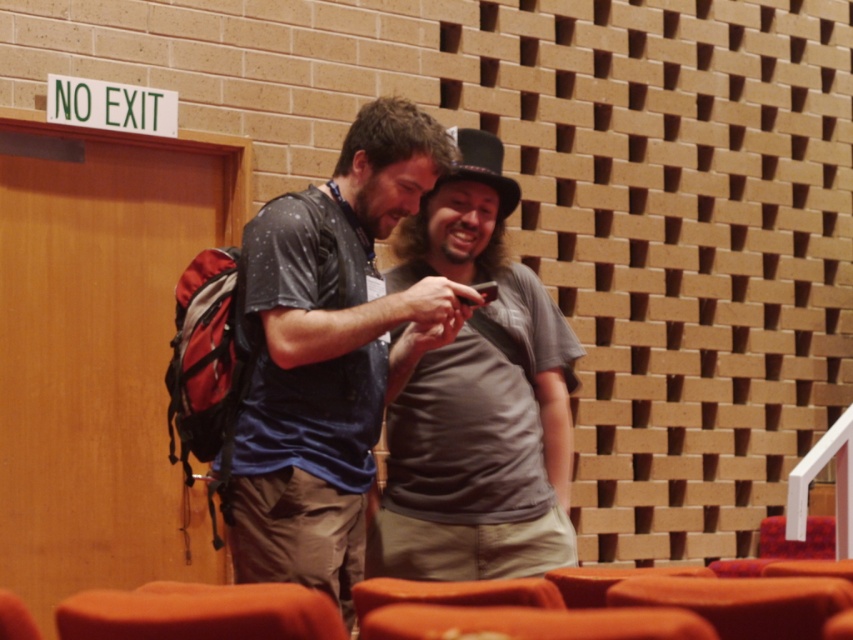
Question: Considering the relative positions of matte blue shirt at center and gray cotton shirt at center in the image provided, where is matte blue shirt at center located with respect to gray cotton shirt at center?

Choices:
 (A) above
 (B) below

Answer: (A)

Question: Is gray cotton shirt at center to the right of orange fabric chair at lower left from the viewer's perspective?

Choices:
 (A) yes
 (B) no

Answer: (A)

Question: Which point appears closest to the camera in this image?

Choices:
 (A) (564, 461)
 (B) (222, 600)

Answer: (B)

Question: Which of the following is the farthest from the observer?

Choices:
 (A) matte blue shirt at center
 (B) gray cotton shirt at center

Answer: (B)

Question: Which object is closer to the camera taking this photo?

Choices:
 (A) matte blue shirt at center
 (B) gray cotton shirt at center
 (C) orange fabric chair at lower left

Answer: (C)

Question: Is matte blue shirt at center further to the viewer compared to orange fabric chair at lower left?

Choices:
 (A) yes
 (B) no

Answer: (A)